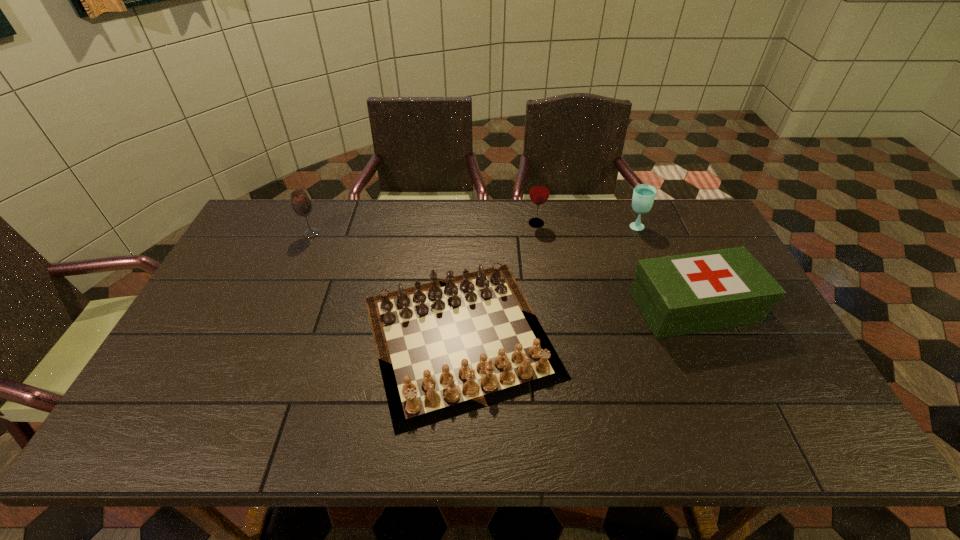
You are a GUI agent. You are given a task and a screenshot of the screen. Output one action in this format:
    pyautogui.click(x=<x>, y=<y>)
    Task: Click on the object present at the near edge
    
    Given the screenshot: What is the action you would take?
    pyautogui.click(x=447, y=345)

Where is `object positioned at the right edge`? The image size is (960, 540). object positioned at the right edge is located at coordinates (682, 294).

In the image, there is a desktop. Where is `vacant region at the far edge`? Image resolution: width=960 pixels, height=540 pixels. vacant region at the far edge is located at coordinates (330, 215).

Identify the location of vacant space at the near edge of the desktop. (633, 423).

Identify the location of vacant area at the left edge. (188, 369).

In the image, there is a desktop. In order to click on free space at the far left corner in this screenshot , I will do `click(275, 231)`.

In the image, there is a desktop. Identify the location of free space at the far right corner. (697, 230).

I want to click on free space between the shortest object and the rightmost glass, so click(x=547, y=281).

At what (x,y) coordinates should I click in order to perform the action: click on empty location between the shortest object and the first-aid kit. Please return your answer as a coordinate pair (x, y). Image resolution: width=960 pixels, height=540 pixels. Looking at the image, I should click on (577, 321).

Locate an element on the screen. The height and width of the screenshot is (540, 960). free spot between the leftmost object and the chessboard is located at coordinates (386, 285).